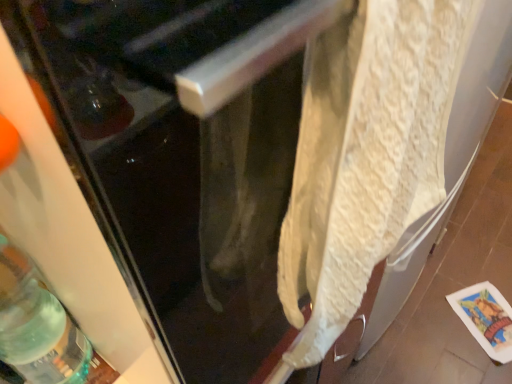
Question: Relative to white textured towel at right, is translucent green glass bottle at lower left in front or behind?

Choices:
 (A) front
 (B) behind

Answer: (B)

Question: Is translucent green glass bottle at lower left bigger or smaller than white textured towel at right?

Choices:
 (A) big
 (B) small

Answer: (B)

Question: Which object is positioned closest to the white textured towel at right?

Choices:
 (A) translucent green glass bottle at lower left
 (B) white textured towel at center

Answer: (B)

Question: Based on their relative distances, which object is farther from the white textured towel at center?

Choices:
 (A) translucent green glass bottle at lower left
 (B) white textured towel at right

Answer: (A)